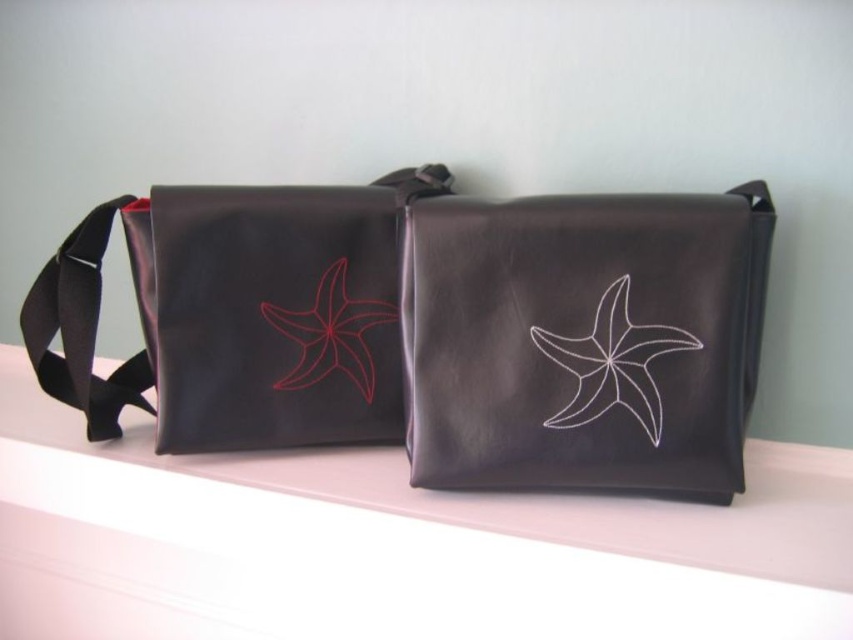
Can you confirm if matte black pouch at center is positioned to the left of white matte star at center?

Correct, you'll find matte black pouch at center to the left of white matte star at center.

Describe the element at coordinates (584, 340) in the screenshot. The width and height of the screenshot is (853, 640). I see `matte black pouch at center` at that location.

Find the location of a particular element. Image resolution: width=853 pixels, height=640 pixels. matte black pouch at center is located at coordinates (584, 340).

Can you confirm if white glossy window sill at center is positioned to the right of white matte star at center?

Incorrect, white glossy window sill at center is not on the right side of white matte star at center.

Can you confirm if white glossy window sill at center is taller than white matte star at center?

Yes, white glossy window sill at center is taller than white matte star at center.

Is point (508, 502) positioned in front of point (560, 358)?

No, it is behind (560, 358).

The height and width of the screenshot is (640, 853). What are the coordinates of `white glossy window sill at center` in the screenshot? It's located at (518, 493).

Can you confirm if matte black bag at center is positioned to the left of matte black pouch at center?

Indeed, matte black bag at center is positioned on the left side of matte black pouch at center.

From the picture: Which is below, matte black bag at center or matte black pouch at center?

matte black pouch at center

Find the location of a particular element. matte black bag at center is located at coordinates (430, 328).

Where is `matte black bag at center`? This screenshot has width=853, height=640. matte black bag at center is located at coordinates (430, 328).